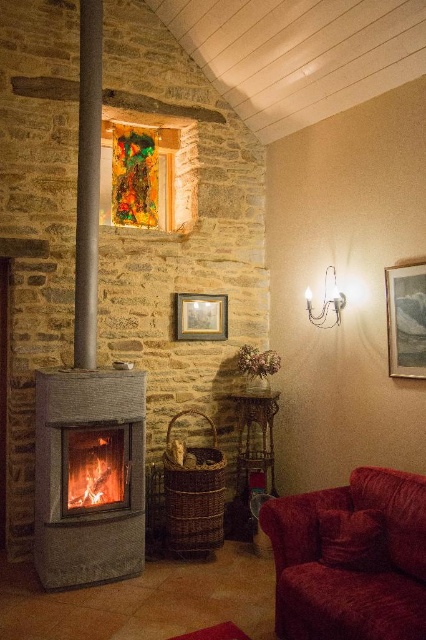
Does matte gray fireplace at left appear on the right side of smooth gray beam at left?

Indeed, matte gray fireplace at left is positioned on the right side of smooth gray beam at left.

The image size is (426, 640). I want to click on matte gray fireplace at left, so click(89, 476).

Does point (83, 400) come closer to viewer compared to point (86, 246)?

Yes, point (83, 400) is in front of point (86, 246).

This screenshot has width=426, height=640. I want to click on matte gray fireplace at left, so click(89, 476).

Is velvet red couch at lower right to the left of orange glowing wood at center from the viewer's perspective?

Incorrect, velvet red couch at lower right is not on the left side of orange glowing wood at center.

Is point (305, 499) farther from viewer compared to point (77, 492)?

No, it is not.

Where is `velvet red couch at lower right`? velvet red couch at lower right is located at coordinates coord(351,557).

Can you confirm if velvet red couch at lower right is positioned below matte gray fireplace at left?

Correct, velvet red couch at lower right is located below matte gray fireplace at left.

Is velvet red couch at lower right smaller than matte gray fireplace at left?

Actually, velvet red couch at lower right might be larger than matte gray fireplace at left.

What do you see at coordinates (351, 557) in the screenshot? I see `velvet red couch at lower right` at bounding box center [351, 557].

The height and width of the screenshot is (640, 426). Find the location of `velvet red couch at lower right`. velvet red couch at lower right is located at coordinates (351, 557).